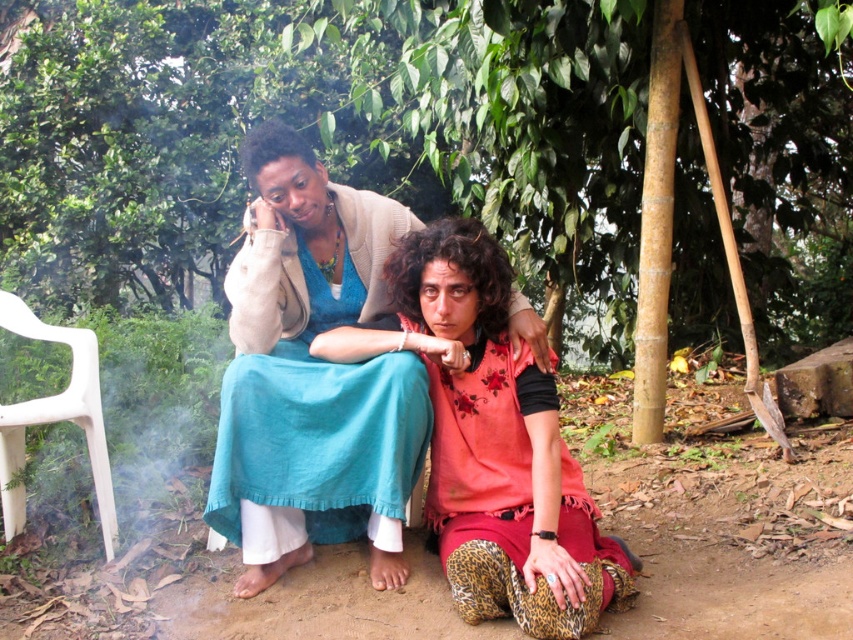
Is green leafy tree at upper center bigger than matte blue dress at center?

Indeed, green leafy tree at upper center has a larger size compared to matte blue dress at center.

Is point (276, 61) farther from camera compared to point (410, 227)?

Yes.

What do you see at coordinates (358, 145) in the screenshot? The image size is (853, 640). I see `green leafy tree at upper center` at bounding box center [358, 145].

This screenshot has width=853, height=640. I want to click on green leafy tree at upper center, so click(358, 145).

Can you confirm if matte blue dress at center is shorter than floral fabric dress at center?

In fact, matte blue dress at center may be taller than floral fabric dress at center.

Is matte blue dress at center to the left of floral fabric dress at center from the viewer's perspective?

Yes, matte blue dress at center is to the left of floral fabric dress at center.

Is point (289, 456) behind point (541, 444)?

That is True.

This screenshot has height=640, width=853. I want to click on matte blue dress at center, so click(x=312, y=374).

Who is taller, green leafy tree at upper center or white plastic chair at left?

With more height is white plastic chair at left.

Between point (352, 124) and point (12, 404), which one is positioned behind?

Point (352, 124)

Locate an element on the screen. This screenshot has height=640, width=853. green leafy tree at upper center is located at coordinates (358, 145).

Locate an element on the screen. green leafy tree at upper center is located at coordinates (358, 145).